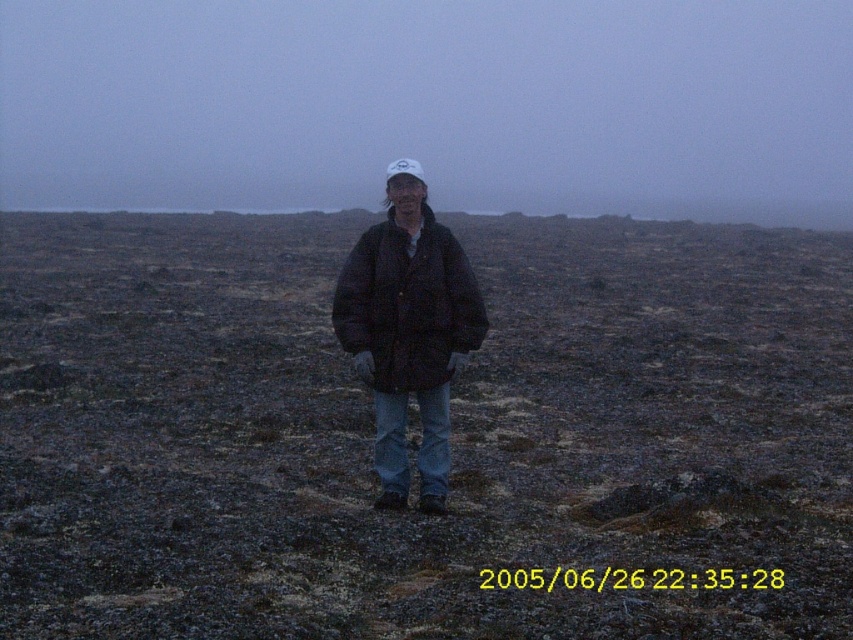
How distant is dark brown soil at center from black puffy jacket at center?

dark brown soil at center is 5.42 meters from black puffy jacket at center.

Which is behind, point (846, 262) or point (390, 227)?

Positioned behind is point (846, 262).

What do you see at coordinates (451, 433) in the screenshot? The width and height of the screenshot is (853, 640). I see `dark brown soil at center` at bounding box center [451, 433].

Locate an element on the screen. This screenshot has width=853, height=640. dark brown soil at center is located at coordinates (451, 433).